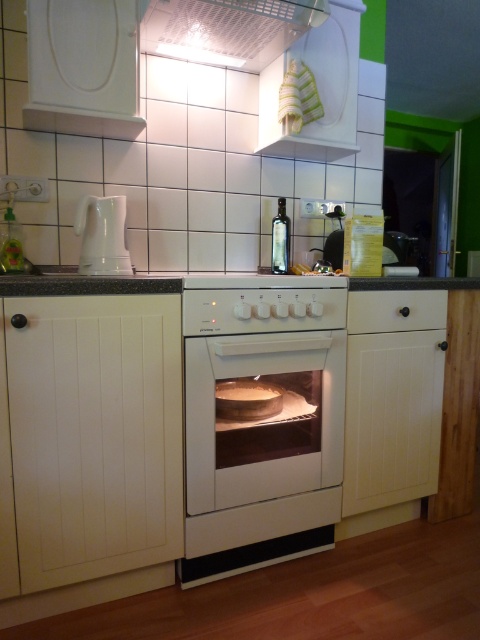
You are a kitchen assistant who needs to access both the white wood drawer at right and the white glossy kettle at left. Which object is closer to you?

The white wood drawer at right is closer to you since it is further to the viewer than the white glossy kettle at left.

You are a chef preparing to clean the kitchen. You need to reach the top of the white matte oven at center and the white wood drawer at right. Which one will require you to use a step stool to reach the top?

The white matte oven at center is much taller than the white wood drawer at right, so you will need a step stool to reach the top of the white matte oven at center.

You need to store a large utensil set that requires a spacious compartment. Looking at the white wood drawer at right and the white glossy kettle at left, which one would be more suitable for storing the utensil set?

The white wood drawer at right has a larger size compared to the white glossy kettle at left, making it more suitable for storing the large utensil set.